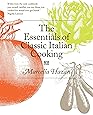
This screenshot has height=115, width=93. I want to click on book, so click(x=49, y=91).